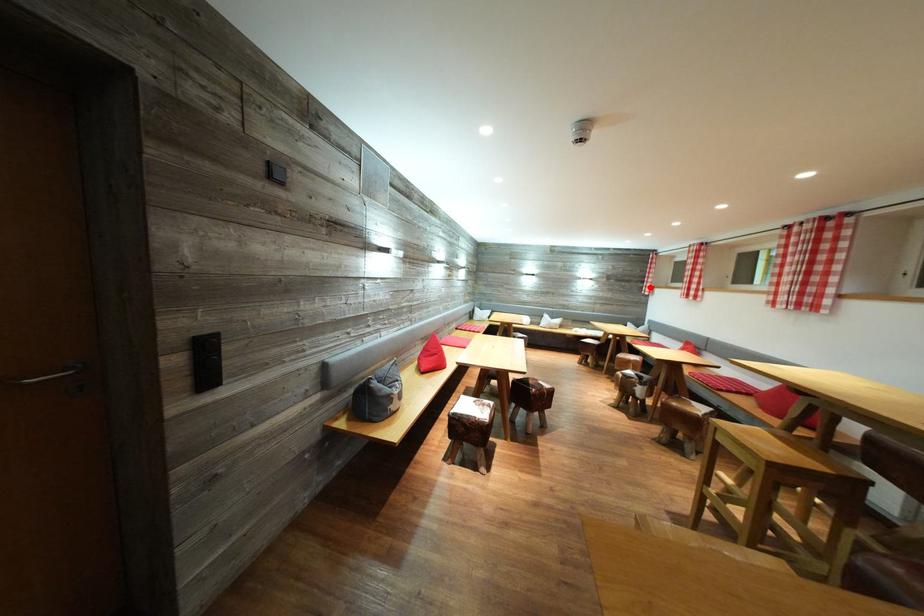
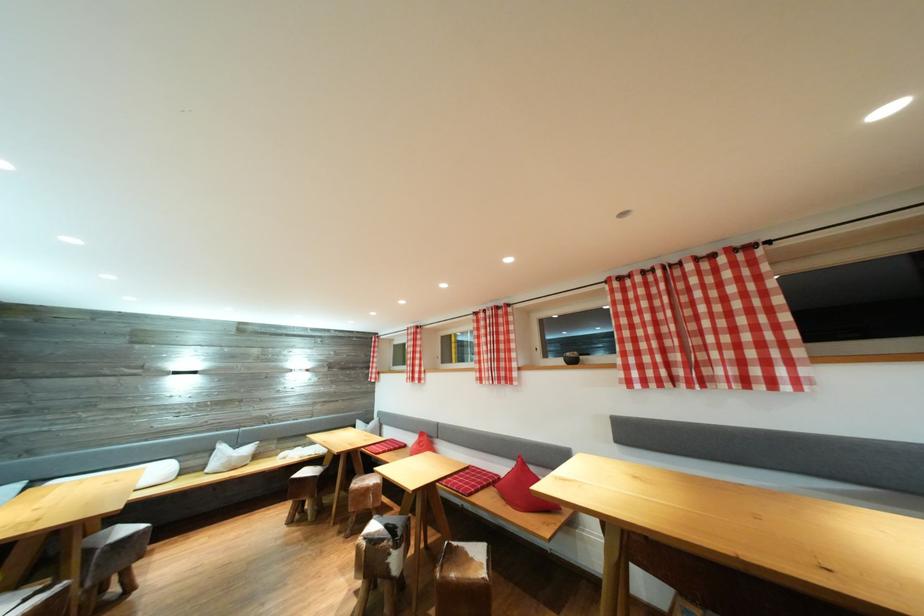
Locate, in the second image, the point that corresponds to the highlighted location in the first image.

(375, 373)